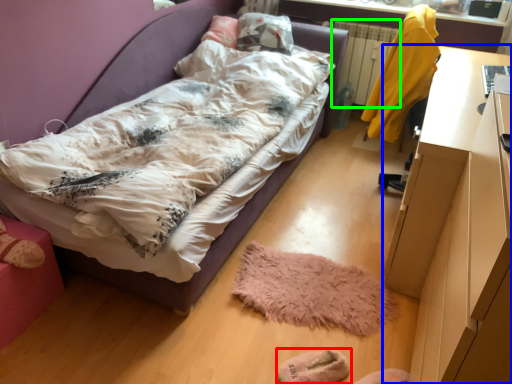
Question: Considering the real-world distances, which object is farthest from footwear (highlighted by a red box)? desk (highlighted by a blue box) or radiator (highlighted by a green box)?

Choices:
 (A) desk
 (B) radiator

Answer: (B)